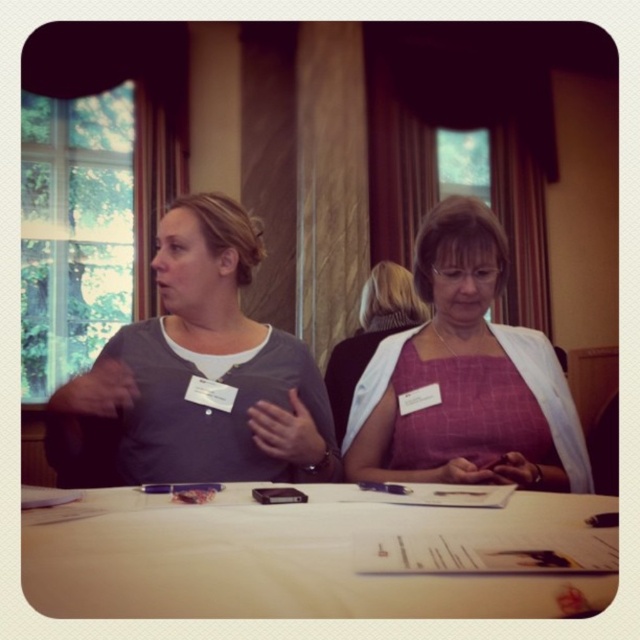
You are organizing a charity event and need to choose a shirt and dress for two volunteers. The volunteers must wear outfits that are clearly distinguishable in size. Given the gray matte shirt at center and the pink fabric dress at center, which outfit should each volunteer choose to ensure the size difference is obvious?

The gray matte shirt at center is bigger than the pink fabric dress at center. Therefore, one volunteer should wear the gray matte shirt at center and the other should wear the pink fabric dress at center to ensure the size difference is obvious.

You are organizing a photo shoot and need to ensure that the gray matte shirt at center and the pink fabric dress at center are positioned so that their widths are clearly visible. Based on the scene description, which clothing item is wider?

The gray matte shirt at center is wider than the pink fabric dress at center according to the description.